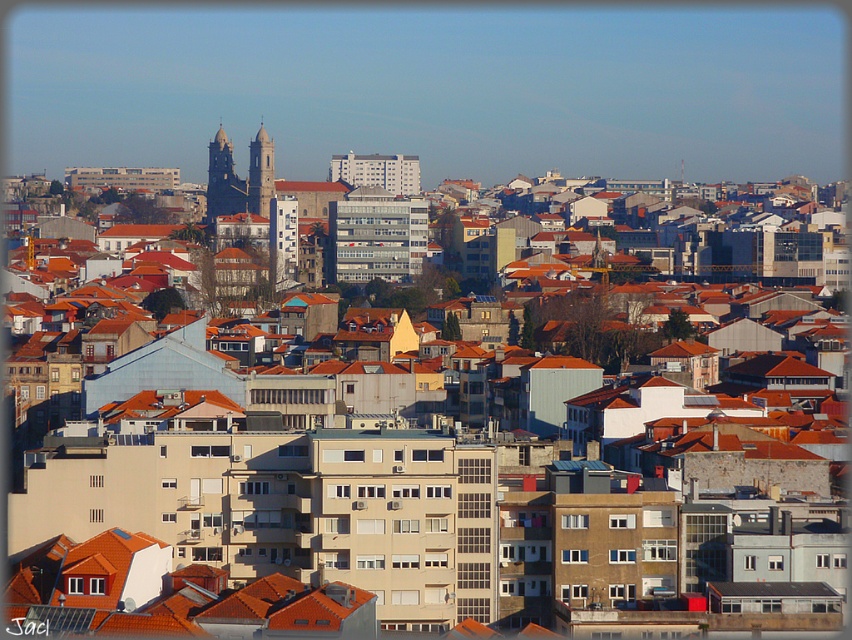
Based on the photo, you are a drone operator tasked with flying a drone between the dark gray stone tower at upper center and the smooth stone tower at center. Given that the drone has a wingspan of 4.5 meters, can it safely navigate the space between them without touching either tower?

The distance between the dark gray stone tower at upper center and the smooth stone tower at center is 4.96 meters. Since the drone has a wingspan of 4.5 meters, there is enough space for it to pass safely between them without touching either tower.

You are an urban planner analyzing this cityscape. You notice two towers in the scene. Based on their positions, which tower is closer to the ground level? Please refer to the dark gray stone tower at upper center and the smooth stone tower at center.

The dark gray stone tower at upper center is closer to the ground level because it is positioned below the smooth stone tower at center.

From the picture: You are standing at the point marked by the coordinates point (x=223, y=180) in the cityscape. Looking around, you notice a dark gray stone tower at upper center. Based on your current position, which direction should you face to see the dark gray stone tower at upper center?

Since you are at point (x=223, y=180) and the dark gray stone tower at upper center is located at upper center, you should face upwards to see it.